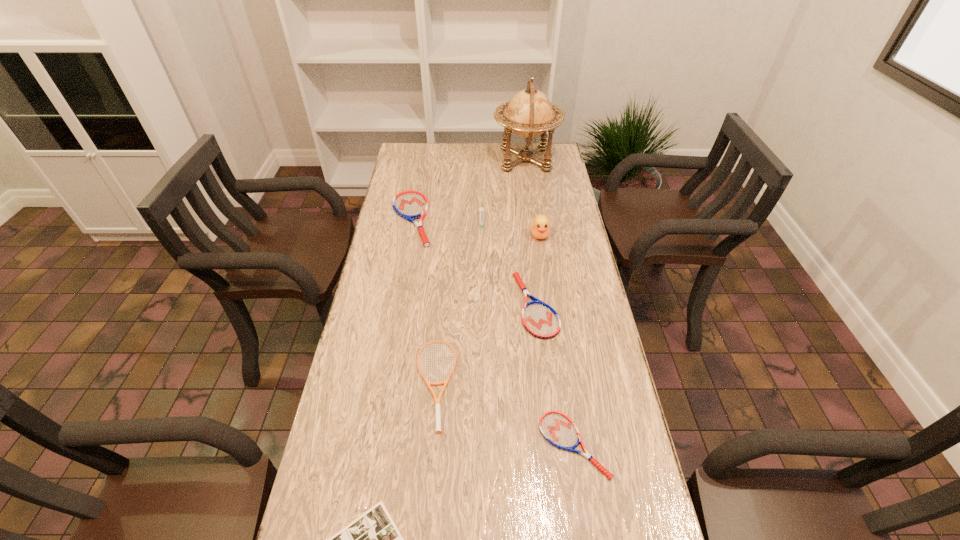
Where is `free space at the far left corner of the desktop`? This screenshot has height=540, width=960. free space at the far left corner of the desktop is located at coordinates (399, 162).

Identify the location of free spot between the yellow duckling and the leftmost blue tennis racket. Image resolution: width=960 pixels, height=540 pixels. (475, 227).

At what (x,y) coordinates should I click in order to perform the action: click on free space between the fifth object from right to left and the yellow duckling. Please return your answer as a coordinate pair (x, y). The height and width of the screenshot is (540, 960). Looking at the image, I should click on pyautogui.click(x=511, y=229).

The image size is (960, 540). Identify the location of vacant space that is in between the second biggest blue tennis racket and the nearest blue tennis racket. (555, 375).

Identify the location of empty location between the fifth object from right to left and the farthest blue tennis racket. (446, 221).

At what (x,y) coordinates should I click in order to perform the action: click on free area in between the farthest tennis racket and the tallest object. Please return your answer as a coordinate pair (x, y). Image resolution: width=960 pixels, height=540 pixels. Looking at the image, I should click on (468, 190).

This screenshot has width=960, height=540. I want to click on unoccupied position between the second farthest tennis racket and the syringe, so point(509,264).

Where is `free point between the shortest tennis racket and the fourth nearest object`? This screenshot has width=960, height=540. free point between the shortest tennis racket and the fourth nearest object is located at coordinates (555, 375).

You are a GUI agent. You are given a task and a screenshot of the screen. Output one action in this format:
    pyautogui.click(x=<x>, y=<y>)
    Task: Click on the blank region between the fourth nearest object and the white syringe
    This screenshot has height=540, width=960.
    Given the screenshot: What is the action you would take?
    pyautogui.click(x=509, y=264)

The height and width of the screenshot is (540, 960). I want to click on free spot between the shortest tennis racket and the seventh shortest object, so click(557, 340).